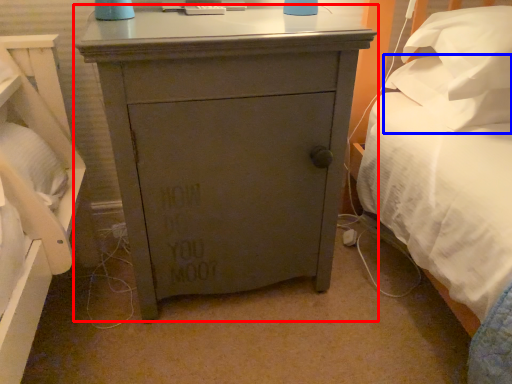
Question: Which point is closer to the camera, chest of drawers (highlighted by a red box) or pillow (highlighted by a blue box)?

Choices:
 (A) chest of drawers
 (B) pillow

Answer: (A)